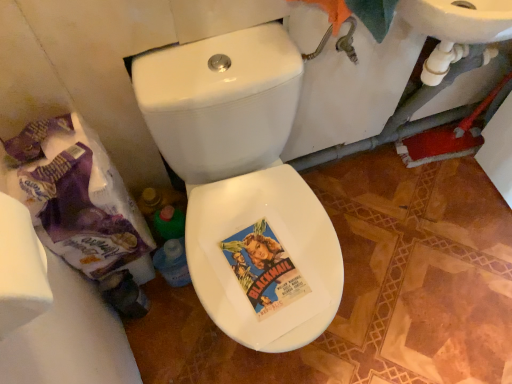
Question: From the image's perspective, is white glossy bidet at center above or below white matte toilet paper at left?

Choices:
 (A) above
 (B) below

Answer: (B)

Question: In terms of size, does white glossy bidet at center appear bigger or smaller than white matte toilet paper at left?

Choices:
 (A) big
 (B) small

Answer: (B)

Question: Based on their relative distances, which object is nearer to the white glossy toilet at center?

Choices:
 (A) white glossy bidet at center
 (B) white matte toilet paper at left

Answer: (A)

Question: Which is nearer to the white glossy bidet at center?

Choices:
 (A) white matte toilet paper at left
 (B) white glossy toilet at center

Answer: (B)